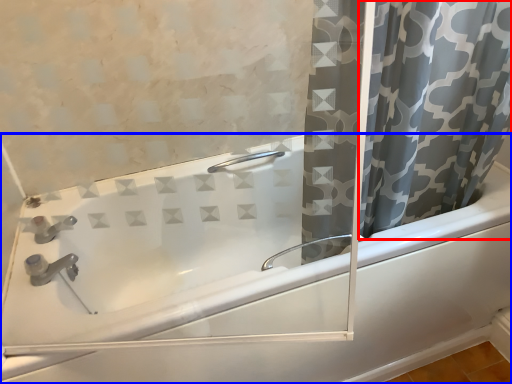
Question: Which object appears farthest to the camera in this image, curtain (highlighted by a red box) or bathtub (highlighted by a blue box)?

Choices:
 (A) curtain
 (B) bathtub

Answer: (B)